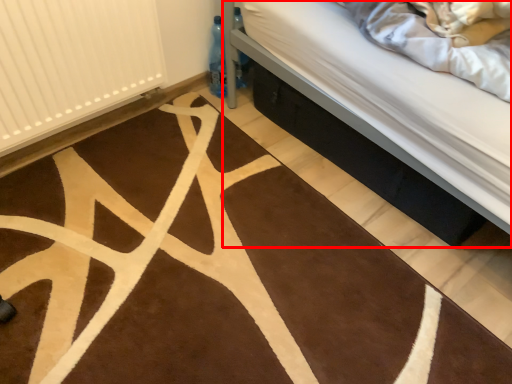
Question: From the image's perspective, where is bed (annotated by the red box) located in relation to radiator in the image?

Choices:
 (A) below
 (B) above

Answer: (A)